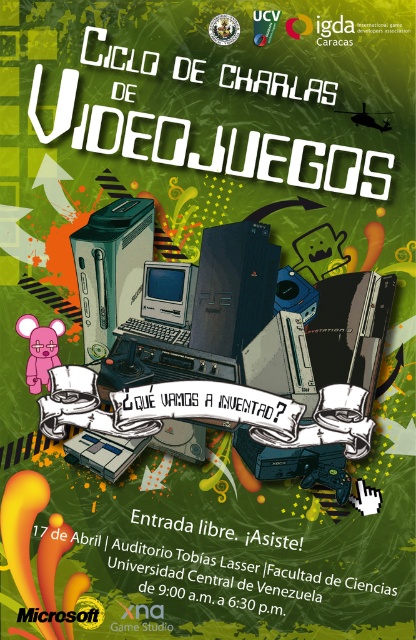
You are designing a poster for a video game event and need to arrange the satin black playstation at center and the green matte xbox at center. Which console should you place higher up if you want the taller one to be more prominent?

The green matte xbox at center is taller than the satin black playstation at center, so you should place the green matte xbox at center higher up to make it more prominent.

You are designing a poster for a video game event and need to place the green matte xbox at center and the pink rubber mouse at lower left. Based on their sizes, which object requires more horizontal space?

The green matte xbox at center might be wider than the pink rubber mouse at lower left, so it likely requires more horizontal space.